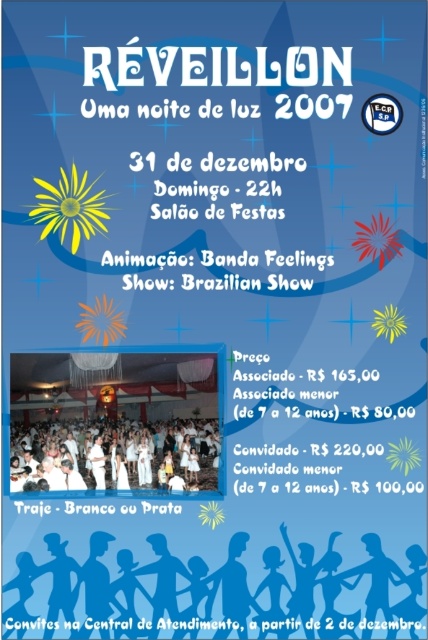
You are looking at the promotional poster for the New Year event. Where exactly are the silhouette paper people at lower center located on the poster?

The silhouette paper people at lower center are located at point [214,592] on the poster.

From the picture: In the promotional poster for the New Year event, there are two elements at the bottom half of the poster. One is the silhouette paper people at lower center and the other is the white cloth dress at center. Which one appears taller in the poster?

The silhouette paper people at lower center is taller than the white cloth dress at center according to the description.